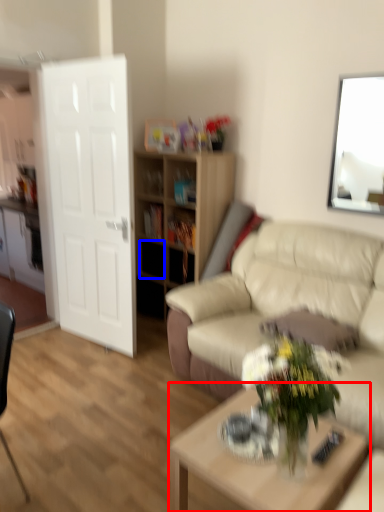
Question: Among these objects, which one is farthest to the camera, coffee table (highlighted by a red box) or drawer (highlighted by a blue box)?

Choices:
 (A) coffee table
 (B) drawer

Answer: (B)